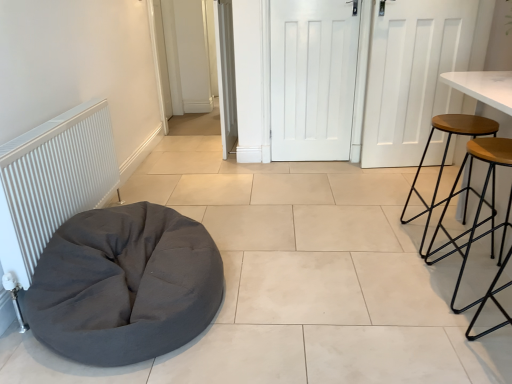
This screenshot has height=384, width=512. Find the location of `free space between wooden seat stool at right, which is the first stool in front-to-back order, and dark gray fabric bean bag at lower left`. free space between wooden seat stool at right, which is the first stool in front-to-back order, and dark gray fabric bean bag at lower left is located at coordinates (332, 292).